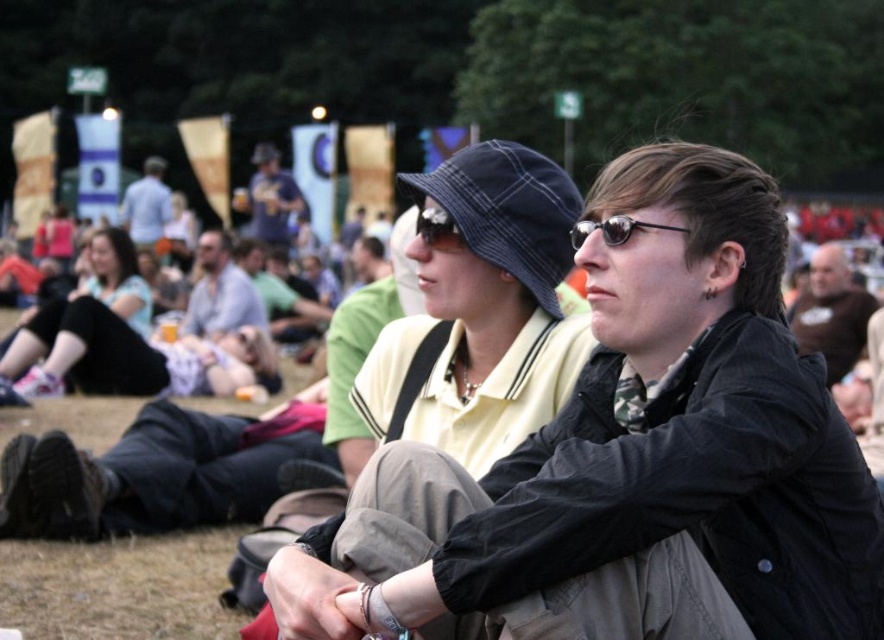
Does matte black jacket at center appear on the right side of light gray shirt at center?

No, matte black jacket at center is not to the right of light gray shirt at center.

Which is above, matte black jacket at center or light gray shirt at center?

light gray shirt at center is higher up.

Describe the element at coordinates (90, 332) in the screenshot. I see `matte black jacket at center` at that location.

I want to click on matte black jacket at center, so click(x=90, y=332).

Can you confirm if dark brown leather jacket at upper right is shorter than light blue shirt at upper center?

No.

Describe the element at coordinates (831, 312) in the screenshot. I see `dark brown leather jacket at upper right` at that location.

The image size is (884, 640). Find the location of `dark brown leather jacket at upper right`. dark brown leather jacket at upper right is located at coordinates (831, 312).

Between matte black jacket at center and sunglasses at center, which one has more height?

With more height is matte black jacket at center.

Is matte black jacket at center wider than sunglasses at center?

Indeed, matte black jacket at center has a greater width compared to sunglasses at center.

Find the location of a particular element. The height and width of the screenshot is (640, 884). matte black jacket at center is located at coordinates (90, 332).